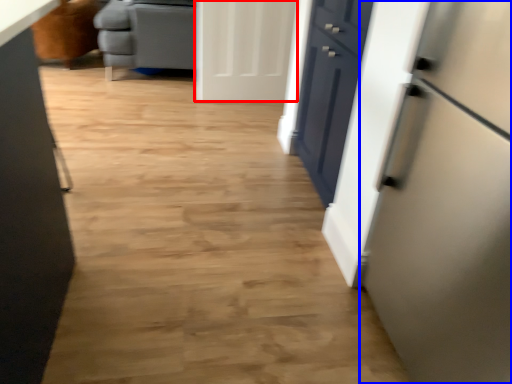
Question: Which object is further to the camera taking this photo, door (highlighted by a red box) or refrigerator (highlighted by a blue box)?

Choices:
 (A) door
 (B) refrigerator

Answer: (A)